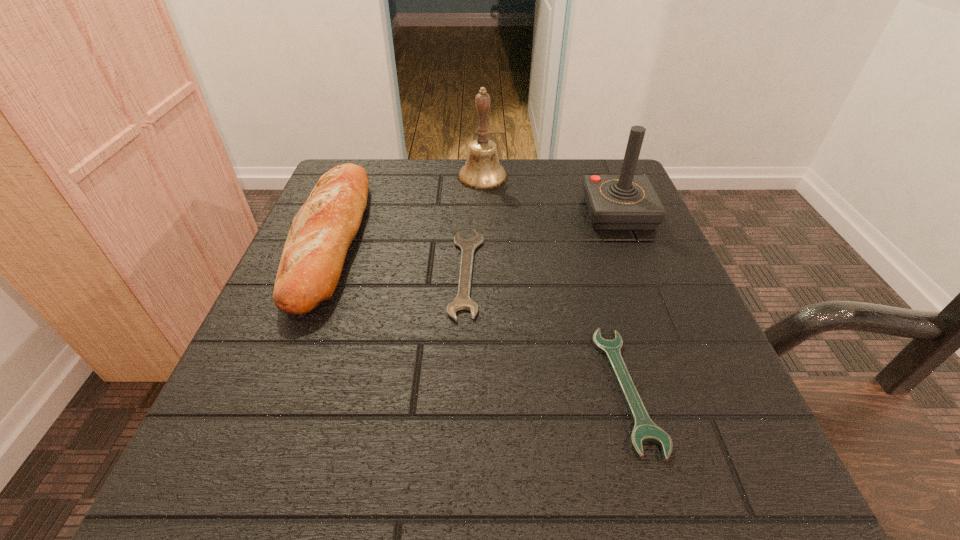
The image size is (960, 540). What are the coordinates of `bell` in the screenshot? It's located at (482, 171).

The width and height of the screenshot is (960, 540). What are the coordinates of `joystick` in the screenshot? It's located at 626,202.

This screenshot has height=540, width=960. What are the coordinates of `the third shortest object` in the screenshot? It's located at (322, 231).

The image size is (960, 540). Identify the location of the leftmost object. (322, 231).

Where is `the left wrench`? The image size is (960, 540). the left wrench is located at coordinates (462, 301).

You are a GUI agent. You are given a task and a screenshot of the screen. Output one action in this format:
    pyautogui.click(x=<x>, y=<y>)
    Task: Click on the nearer wrench
    
    Given the screenshot: What is the action you would take?
    (645, 430)

I want to click on the right wrench, so click(x=645, y=430).

The height and width of the screenshot is (540, 960). Find the location of `vacant space located 0.190m on the front of the bell`. vacant space located 0.190m on the front of the bell is located at coordinates (483, 242).

Where is `vacant area situated 0.240m on the rectangular base of the joystick`? vacant area situated 0.240m on the rectangular base of the joystick is located at coordinates (661, 323).

You are a GUI agent. You are given a task and a screenshot of the screen. Output one action in this format:
    pyautogui.click(x=<x>, y=<y>)
    Task: Click on the vacant point located 0.180m on the front of the leftmost object
    
    Given the screenshot: What is the action you would take?
    pyautogui.click(x=252, y=428)